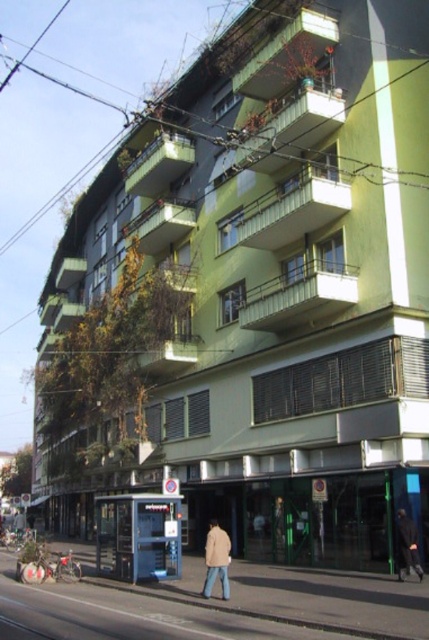
You are standing in front of the residential building and notice two points on its facade. The first point is located at coordinate point [217,573] and the second at point [404,556]. Which of these points is closer to your current position?

Point [217,573] is closer to the camera than point [404,556], so the first point is closer to your current position.

You are standing in front of the residential building and see two jackets hanging on adjacent balconies. Which jacket is closer to you, the beige fabric jacket at lower center or the dark fabric jacket at lower right?

The beige fabric jacket at lower center is closer to the viewer than the dark fabric jacket at lower right.

You are a delivery person trying to place two jackets on a small shelf that can only hold one large jacket or two small ones. You have the beige fabric jacket at lower center and the dark fabric jacket at lower right. Which jacket should you place first to maximize the number of jackets on the shelf?

The beige fabric jacket at lower center is larger than the dark fabric jacket at lower right. To maximize the number of jackets on the shelf, you should place the dark fabric jacket at lower right first since it is smaller and allows room for the larger beige jacket afterward.